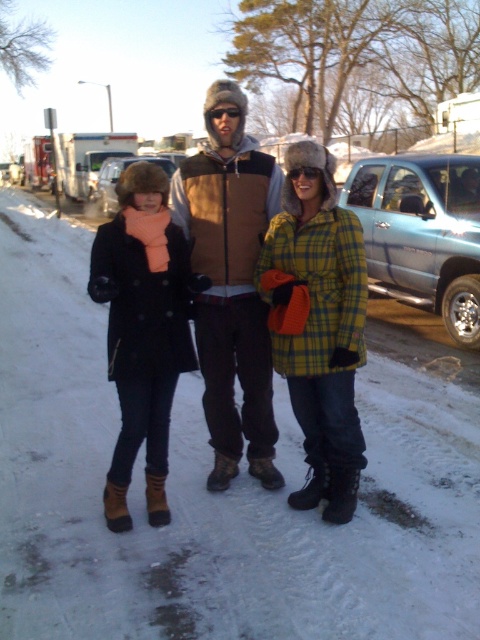
Who is shorter, plaid fabric coat at center or matte black coat at left?

matte black coat at left is shorter.

What do you see at coordinates (275, 304) in the screenshot? I see `plaid fabric coat at center` at bounding box center [275, 304].

Is point (311, 312) positioned after point (158, 472)?

No, it is not.

At what (x,y) coordinates should I click in order to perform the action: click on plaid fabric coat at center. Please return your answer as a coordinate pair (x, y). Looking at the image, I should click on pos(275,304).

Between brown suede vest at center and matte black coat at left, which one is positioned lower?

matte black coat at left is lower down.

Can you confirm if brown suede vest at center is positioned to the left of matte black coat at left?

In fact, brown suede vest at center is to the right of matte black coat at left.

Between point (211, 141) and point (120, 237), which one is positioned in front?

Point (120, 237)

Find the location of a particular element. This screenshot has width=480, height=640. brown suede vest at center is located at coordinates (230, 282).

Can you confirm if plaid fabric coat at center is positioned to the left of brown suede vest at center?

No, plaid fabric coat at center is not to the left of brown suede vest at center.

Is plaid fabric coat at center in front of brown suede vest at center?

Yes, plaid fabric coat at center is in front of brown suede vest at center.

What do you see at coordinates (275, 304) in the screenshot?
I see `plaid fabric coat at center` at bounding box center [275, 304].

Find the location of a particular element. The image size is (480, 640). plaid fabric coat at center is located at coordinates (275, 304).